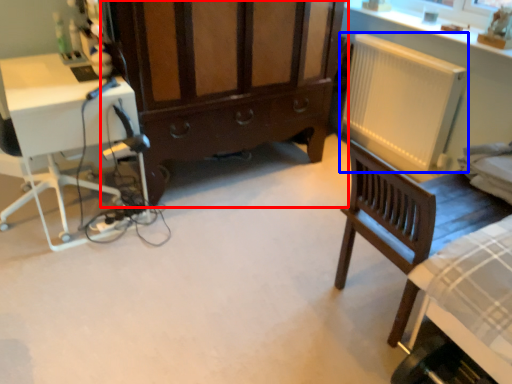
Question: Which object appears farthest to the camera in this image, cabinetry (highlighted by a red box) or radiator (highlighted by a blue box)?

Choices:
 (A) cabinetry
 (B) radiator

Answer: (B)